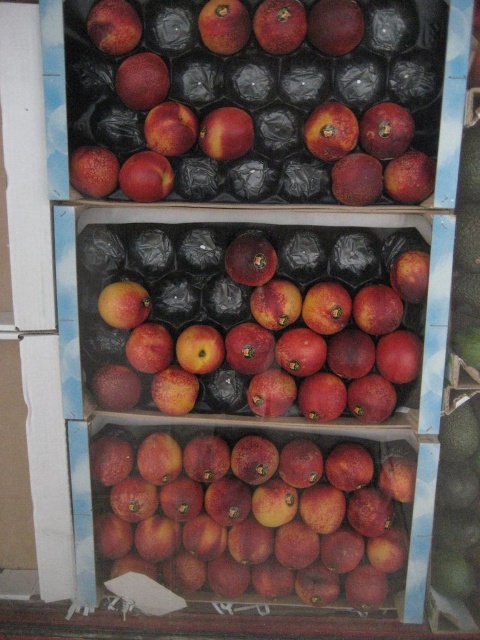
Can you confirm if matte peach at upper center is positioned below matte red apple at upper left?

Actually, matte peach at upper center is above matte red apple at upper left.

Does matte peach at upper center appear on the right side of matte red apple at upper left?

Yes, matte peach at upper center is to the right of matte red apple at upper left.

Is point (182, 150) farther from viewer compared to point (168, 179)?

No, it is in front of (168, 179).

The height and width of the screenshot is (640, 480). Find the location of `matte peach at upper center`. matte peach at upper center is located at coordinates (169, 129).

Looking at this image, does glossy red peaches at center appear under glossy red apple at center?

Correct, glossy red peaches at center is located below glossy red apple at center.

Does glossy red peaches at center appear on the right side of glossy red apple at center?

Indeed, glossy red peaches at center is positioned on the right side of glossy red apple at center.

Identify the location of glossy red peaches at center. (251, 321).

What are the coordinates of `glossy red peaches at center` in the screenshot? It's located at (251, 321).

Which is behind, point (385, 262) or point (194, 136)?

Point (385, 262)

Does glossy red peaches at center appear under matte peach at upper center?

Yes, glossy red peaches at center is below matte peach at upper center.

Which is behind, point (216, 397) or point (176, 154)?

The point (216, 397) is behind.

Where is `glossy red peaches at center`? glossy red peaches at center is located at coordinates (251, 321).